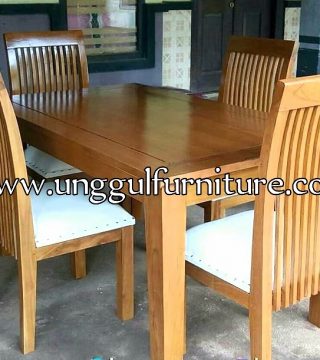
Locate an element on the screen. This screenshot has height=360, width=320. white cushions is located at coordinates (89, 209), (229, 251), (62, 166).